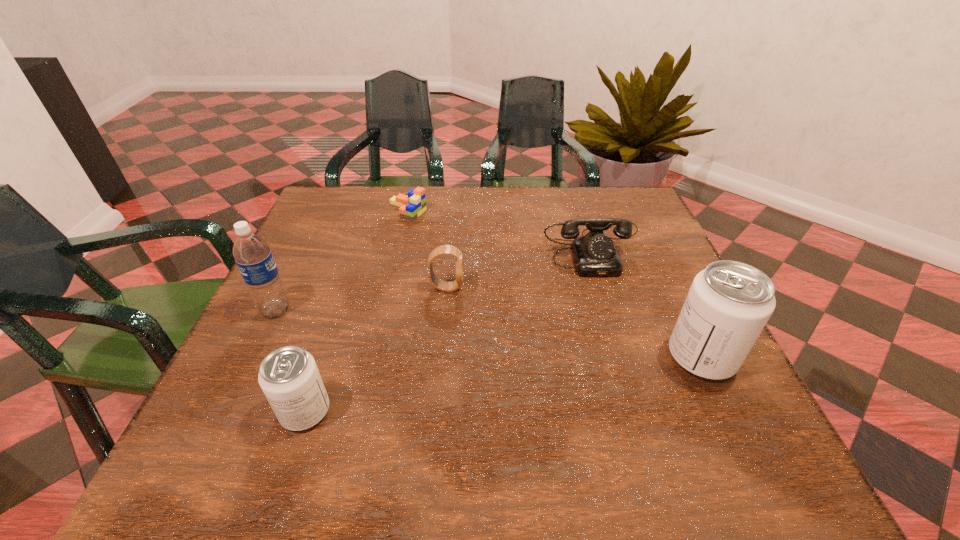
You are a GUI agent. You are given a task and a screenshot of the screen. Output one action in this format:
    pyautogui.click(x=<x>, y=<y>)
    Task: Click on the vacant area that lies between the third object from right to left and the shortest object
    
    Given the screenshot: What is the action you would take?
    tap(427, 249)

Find the location of a particular element. The height and width of the screenshot is (540, 960). unoccupied position between the shortest object and the fourth object from left to right is located at coordinates (427, 249).

You are a GUI agent. You are given a task and a screenshot of the screen. Output one action in this format:
    pyautogui.click(x=<x>, y=<y>)
    Task: Click on the free space that is in between the shortest object and the third object from right to left
    
    Given the screenshot: What is the action you would take?
    pyautogui.click(x=427, y=249)

Point out which object is positioned as the second nearest to the left soda can. Please provide its 2D coordinates. Your answer should be formatted as a tuple, i.e. [(x, y)], where the tuple contains the x and y coordinates of a point satisfying the conditions above.

[(441, 285)]

Find the location of a particular element. The width and height of the screenshot is (960, 540). object identified as the second closest to the telephone is located at coordinates (441, 285).

You are a GUI agent. You are given a task and a screenshot of the screen. Output one action in this format:
    pyautogui.click(x=<x>, y=<y>)
    Task: Click on the vacant position in the image that satisfies the following two spatial constraints: 1. on the back side of the taller soda can; 2. on the right side of the nearest object
    
    Given the screenshot: What is the action you would take?
    pyautogui.click(x=324, y=357)

Identify the location of free space that satisfies the following two spatial constraints: 1. on the front-facing side of the telephone; 2. on the face of the watch. The height and width of the screenshot is (540, 960). (607, 288).